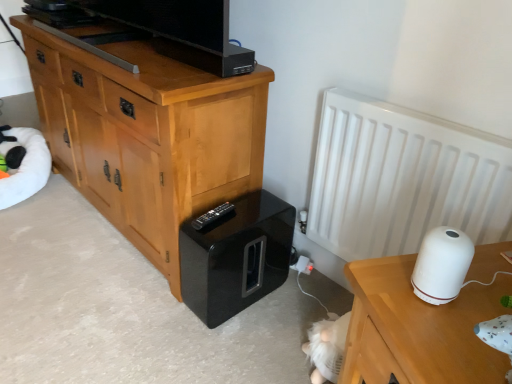
Locate an element on the screen. empty space that is ontop of white matte table at right (from a real-world perspective) is located at coordinates (461, 296).